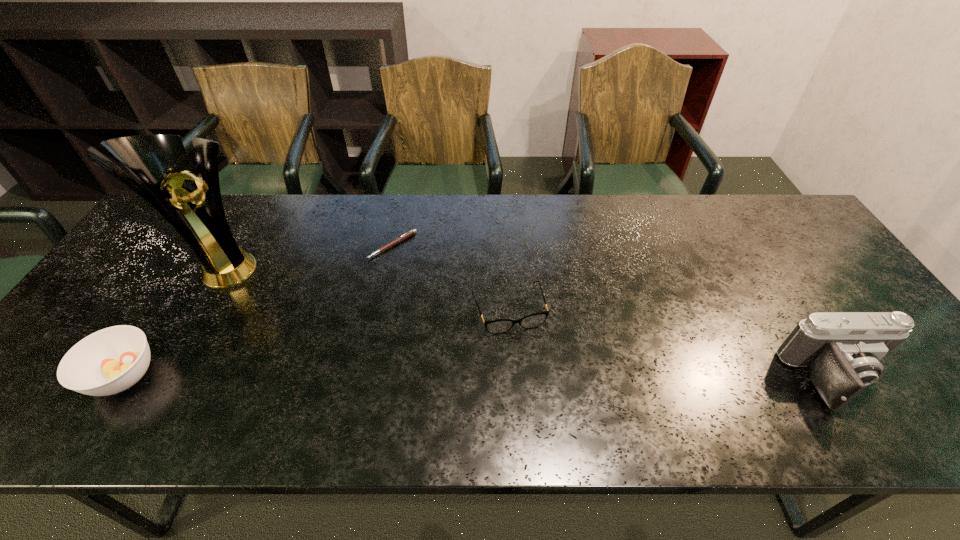
The image size is (960, 540). In order to click on vacant space situated at the nib of the third object from left to right in this screenshot , I will do `click(404, 359)`.

Locate an element on the screen. The image size is (960, 540). vacant space located at the nib of the third object from left to right is located at coordinates (397, 293).

In order to click on free space located 0.050m on the front-facing side of the second shortest object in this screenshot , I will do `click(523, 352)`.

Identify the location of vacant space located 0.080m on the front-facing side of the second shortest object. The height and width of the screenshot is (540, 960). (527, 363).

I want to click on vacant space located 0.110m on the front-facing side of the second shortest object, so click(531, 374).

Find the location of a particular element. This screenshot has height=540, width=960. free space located at the front of the award, where the globe is visible is located at coordinates (334, 335).

What are the coordinates of `vacant space situated 0.240m at the front of the award, where the globe is visible` in the screenshot? It's located at (305, 319).

Find the location of a particular element. vacant region located at the front of the award, where the globe is visible is located at coordinates (325, 330).

Where is `pen positioned at the far edge`? This screenshot has height=540, width=960. pen positioned at the far edge is located at coordinates (411, 232).

Where is `award present at the far edge`? Image resolution: width=960 pixels, height=540 pixels. award present at the far edge is located at coordinates (192, 205).